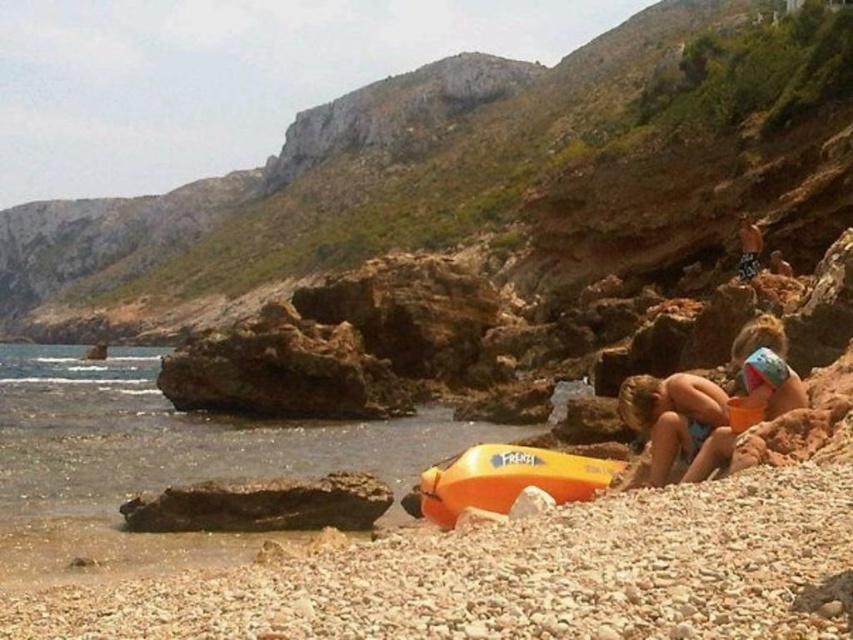
You are standing at the point marked by the coordinates point [508,477] in the coastal scene. What object are you directly facing?

The point [508,477] corresponds to the orange matte kayak at center, so you are directly facing the orange matte kayak at center.